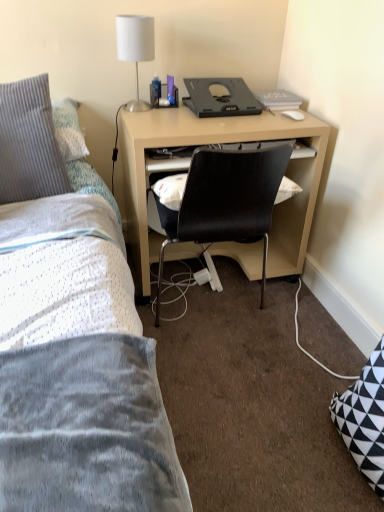
You are a GUI agent. You are given a task and a screenshot of the screen. Output one action in this format:
    pyautogui.click(x=<x>, y=<y>)
    Task: Click on the free space in front of white fabric lampshade at upper center
    This screenshot has width=384, height=512.
    Given the screenshot: What is the action you would take?
    pyautogui.click(x=145, y=118)